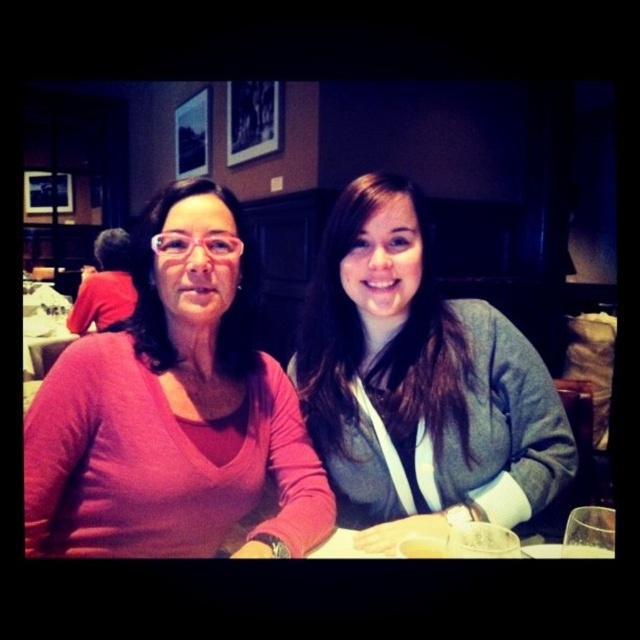
You are a photographer standing at a certain distance from the matte pink sweater at left. If you want to take a closeup photo of the sweater, would you need to move closer or farther away?

The distance between the matte pink sweater at left and the camera is 69.33 centimeters. To take a closeup photo, you would need to move closer to the sweater.

You are a photographer setting up for a group photo. You need to position yourself so that both the matte pink sweater at left and the gray fleece sweater at center are in focus. Which sweater should you focus on first to ensure both are sharp?

You should focus on the matte pink sweater at left first since it is closer to the viewer than the gray fleece sweater at center. By focusing on the closer object, the depth of field will extend to the farther object, ensuring both are in focus.